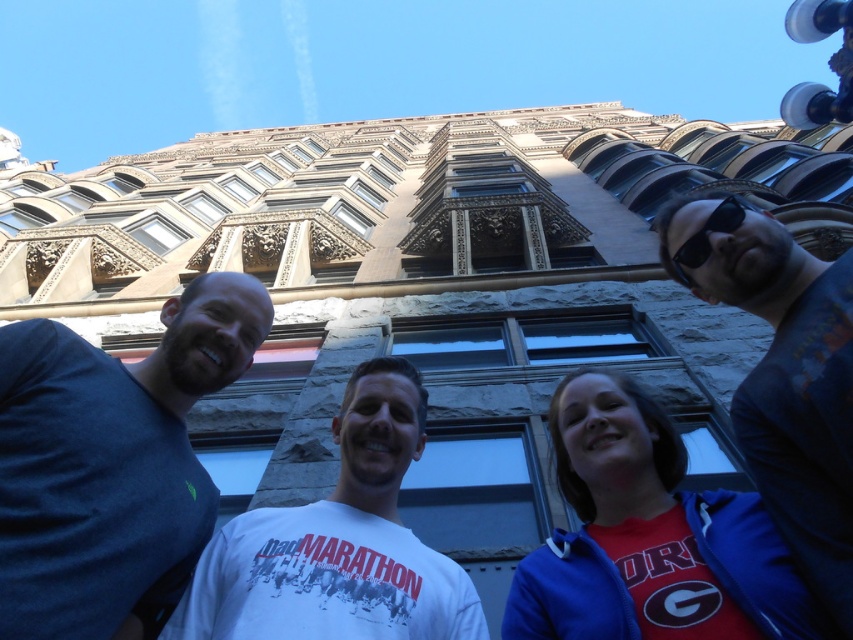
Question: Which point is farther to the camera?

Choices:
 (A) (701, 227)
 (B) (122, 442)

Answer: (A)

Question: Based on their relative distances, which object is farther from the dark blue t-shirt at left?

Choices:
 (A) red matte jacket at lower right
 (B) white cotton t-shirt at center
 (C) dark blue t-shirt at right
 (D) black plastic sunglasses at upper right

Answer: (D)

Question: Is dark blue t-shirt at left above white cotton t-shirt at center?

Choices:
 (A) yes
 (B) no

Answer: (A)

Question: Among these objects, which one is farthest from the camera?

Choices:
 (A) white cotton t-shirt at center
 (B) dark blue t-shirt at right
 (C) red matte jacket at lower right

Answer: (A)

Question: Can you confirm if dark blue t-shirt at left is smaller than red matte jacket at lower right?

Choices:
 (A) no
 (B) yes

Answer: (A)

Question: Where is red matte jacket at lower right located in relation to white cotton t-shirt at center in the image?

Choices:
 (A) right
 (B) left

Answer: (A)